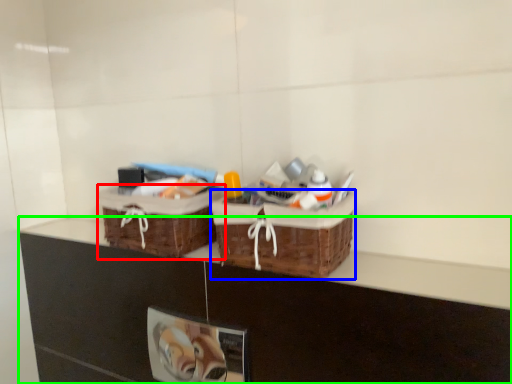
Question: Which object is positioned closest to picnic basket (highlighted by a red box)? Select from picnic basket (highlighted by a blue box) and counter (highlighted by a green box).

Choices:
 (A) picnic basket
 (B) counter

Answer: (B)